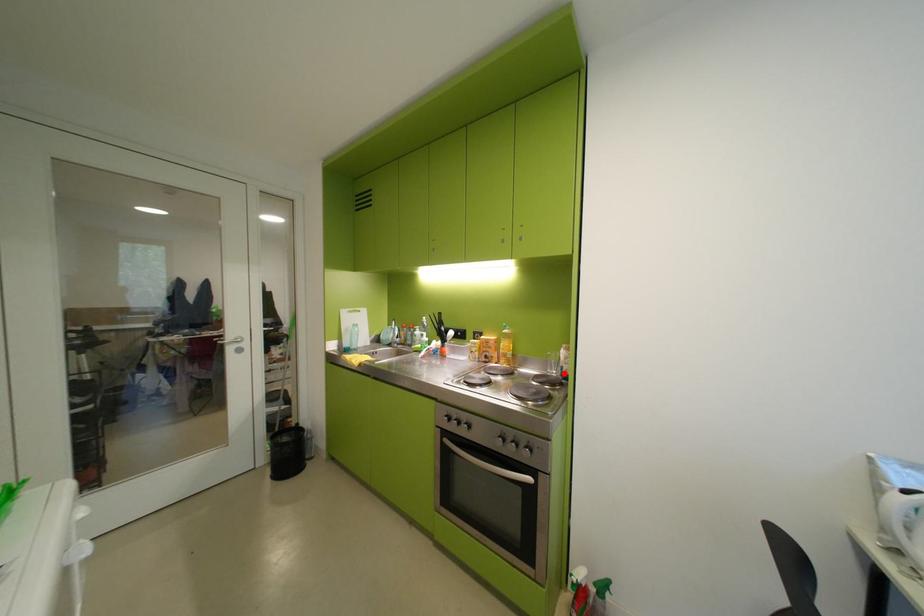
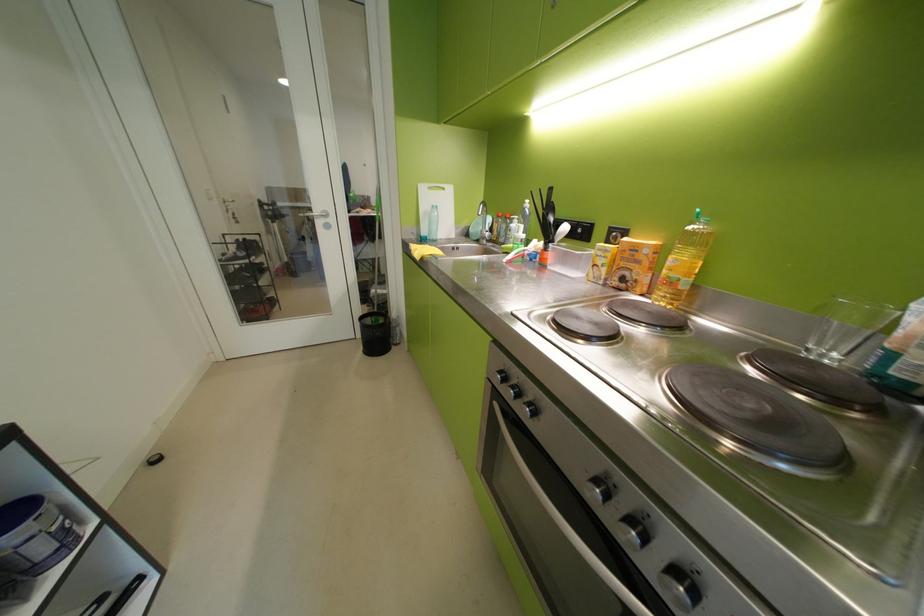
The point at the highlighted location is marked in the first image. Where is the corresponding point in the second image?

(843, 358)